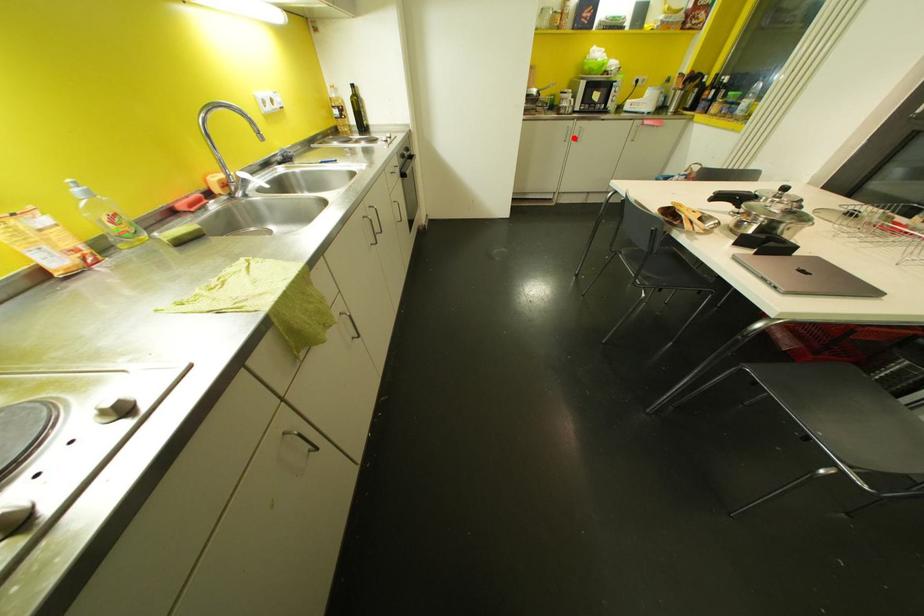
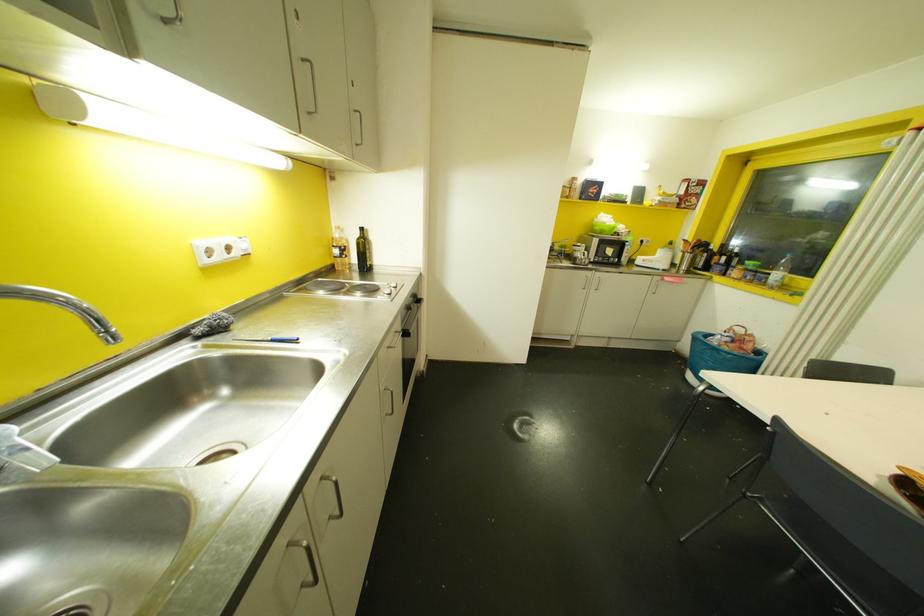
Question: I am providing you with two images of the same scene from different viewpoints. Image1 has a red point marked. In image2, the corresponding 3D location appears at what relative position? Reply with the corresponding letter.

Choices:
 (A) Closer
 (B) Farther

Answer: (B)